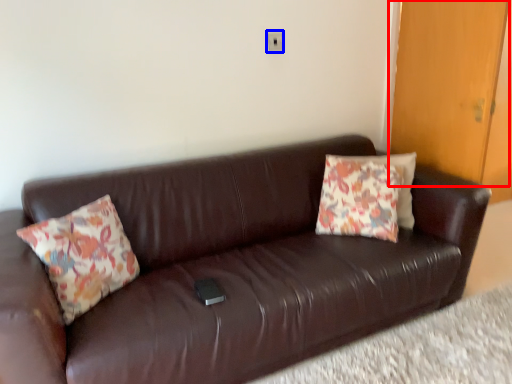
Question: Which object appears farthest to the camera in this image, door (highlighted by a red box) or electric outlet (highlighted by a blue box)?

Choices:
 (A) door
 (B) electric outlet

Answer: (B)